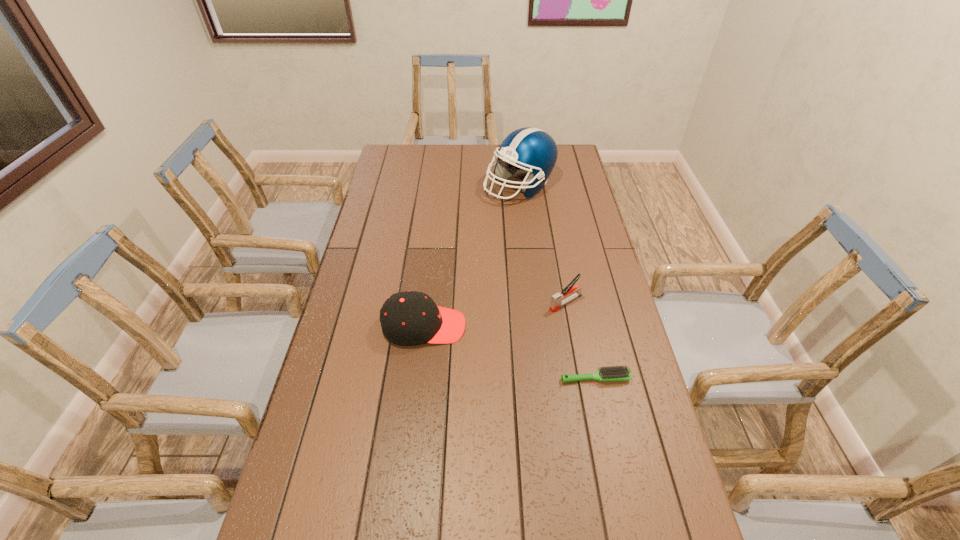
I want to click on vacant area situated on the handle side of the stapler, so click(x=533, y=319).

The width and height of the screenshot is (960, 540). I want to click on vacant area situated at the front of the tallest object with the faceguard, so click(512, 232).

Find the location of a particular element. This screenshot has width=960, height=540. free space located 0.160m at the front of the tallest object with the faceguard is located at coordinates (512, 232).

Locate an element on the screen. The image size is (960, 540). blank space located 0.340m at the front of the tallest object with the faceguard is located at coordinates (507, 264).

Locate an element on the screen. The height and width of the screenshot is (540, 960). object that is at the far edge is located at coordinates (529, 149).

This screenshot has height=540, width=960. I want to click on object at the left edge, so click(407, 318).

You are a GUI agent. You are given a task and a screenshot of the screen. Output one action in this format:
    pyautogui.click(x=<x>, y=<y>)
    Task: Click on the hairbrush located in the right edge section of the desktop
    
    Given the screenshot: What is the action you would take?
    pyautogui.click(x=617, y=373)

Locate an element on the screen. This screenshot has height=540, width=960. stapler located in the right edge section of the desktop is located at coordinates (558, 300).

You are a GUI agent. You are given a task and a screenshot of the screen. Output one action in this format:
    pyautogui.click(x=<x>, y=<y>)
    Task: Click on the football helmet at the right edge
    
    Given the screenshot: What is the action you would take?
    pyautogui.click(x=529, y=149)

At what (x,y) coordinates should I click in order to perform the action: click on object that is at the far right corner. Please return your answer as a coordinate pair (x, y). Looking at the image, I should click on (529, 149).